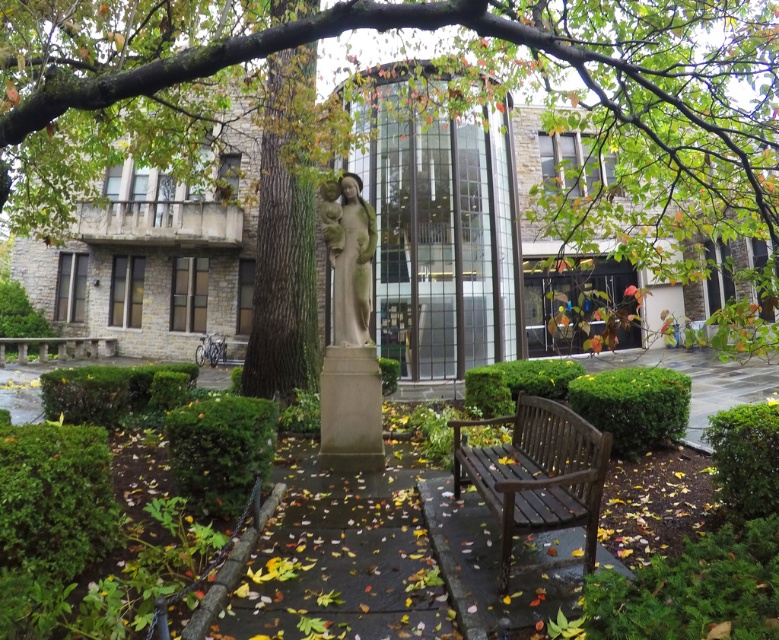
Looking at this image, you are a visitor sitting on the dark brown wooden bench at lower right and want to look at the green leafy tree at center. In which direction should you turn your head?

You should turn your head to the right because the green leafy tree at center is positioned on the right side of dark brown wooden bench at lower right.